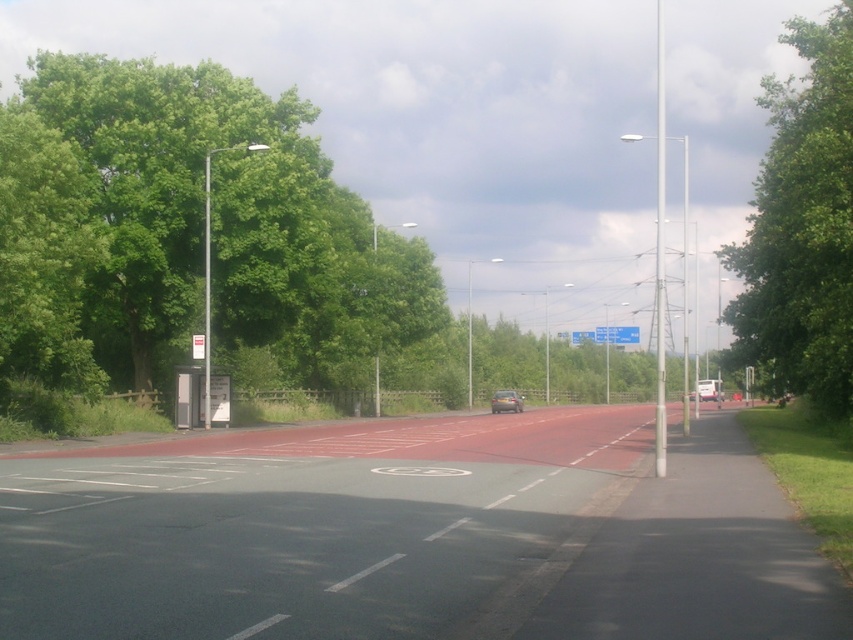
You are driving a car and see two points on the road ahead. The first point is at point (190, 237) and the second is at point (769, 205). Which point is closer to your current position?

Point (769, 205) is closer to your current position because point (190, 237) is behind it.

In the scene shown: You are a pedestrian standing at the edge of the road. You see the green leafy tree at left and the blue plastic sign at center. Which object is closer to your left side?

The green leafy tree at left is to the left of the blue plastic sign at center, so it is closer to your left side.

You are a driver approaching the road and see the blue plastic sign at center and the matte silver car at center. Which object is taller when viewed from your perspective?

The blue plastic sign at center is taller than the matte silver car at center.